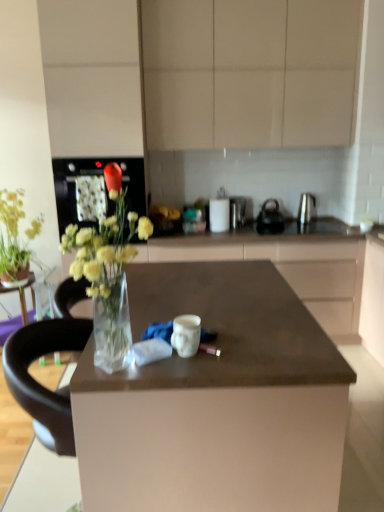
Question: Is polished stainless steel kettle at center, which ranks as the 3th appliance in left-to-right order, at the right side of matte beige cabinets at upper center?

Choices:
 (A) yes
 (B) no

Answer: (A)

Question: Is polished stainless steel kettle at center, acting as the 2th appliance starting from the right, outside of matte beige cabinets at upper center?

Choices:
 (A) yes
 (B) no

Answer: (A)

Question: From the image's perspective, is polished stainless steel kettle at center, which ranks as the 3th appliance in left-to-right order, over matte beige cabinets at upper center?

Choices:
 (A) no
 (B) yes

Answer: (A)

Question: Does polished stainless steel kettle at center, which ranks as the 3th appliance in left-to-right order, turn towards matte beige cabinets at upper center?

Choices:
 (A) yes
 (B) no

Answer: (B)

Question: Is the depth of polished stainless steel kettle at center, acting as the 2th appliance starting from the right, greater than that of matte beige cabinets at upper center?

Choices:
 (A) no
 (B) yes

Answer: (B)

Question: From a real-world perspective, is polished stainless steel kettle at center, which ranks as the 3th appliance in left-to-right order, positioned over matte beige cabinets at upper center based on gravity?

Choices:
 (A) no
 (B) yes

Answer: (A)

Question: Can you confirm if polished stainless steel kettle at center, which ranks as the 3th appliance in left-to-right order, is taller than green matte plant at upper left, which ranks as the first flower in left-to-right order?

Choices:
 (A) no
 (B) yes

Answer: (A)

Question: Can you confirm if polished stainless steel kettle at center, which ranks as the 3th appliance in left-to-right order, is thinner than green matte plant at upper left, which ranks as the 2th flower in right-to-left order?

Choices:
 (A) no
 (B) yes

Answer: (A)

Question: Is polished stainless steel kettle at center, acting as the 2th appliance starting from the right, positioned beyond the bounds of green matte plant at upper left, the 2th flower positioned from the front?

Choices:
 (A) yes
 (B) no

Answer: (A)

Question: Can you confirm if polished stainless steel kettle at center, which ranks as the 3th appliance in left-to-right order, is shorter than green matte plant at upper left, which ranks as the first flower in left-to-right order?

Choices:
 (A) yes
 (B) no

Answer: (A)

Question: From a real-world perspective, is polished stainless steel kettle at center, acting as the 2th appliance starting from the right, located higher than green matte plant at upper left, the first flower from the back?

Choices:
 (A) yes
 (B) no

Answer: (A)

Question: Can you confirm if polished stainless steel kettle at center, acting as the 2th appliance starting from the right, is smaller than green matte plant at upper left, the 2th flower positioned from the front?

Choices:
 (A) no
 (B) yes

Answer: (B)

Question: Is satin silver kettle at right, the 1th appliance in the right-to-left sequence, closer to the viewer compared to matte beige cabinets at upper center?

Choices:
 (A) no
 (B) yes

Answer: (A)